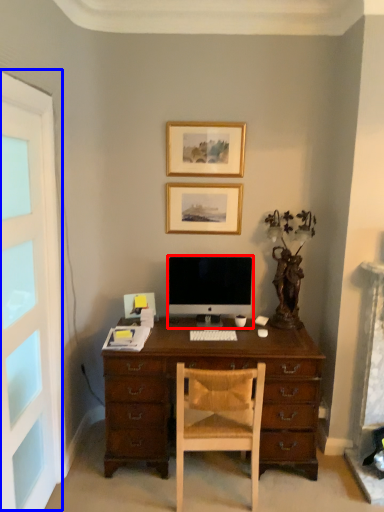
Question: Which object appears closest to the camera in this image, computer monitor (highlighted by a red box) or screen door (highlighted by a blue box)?

Choices:
 (A) computer monitor
 (B) screen door

Answer: (B)